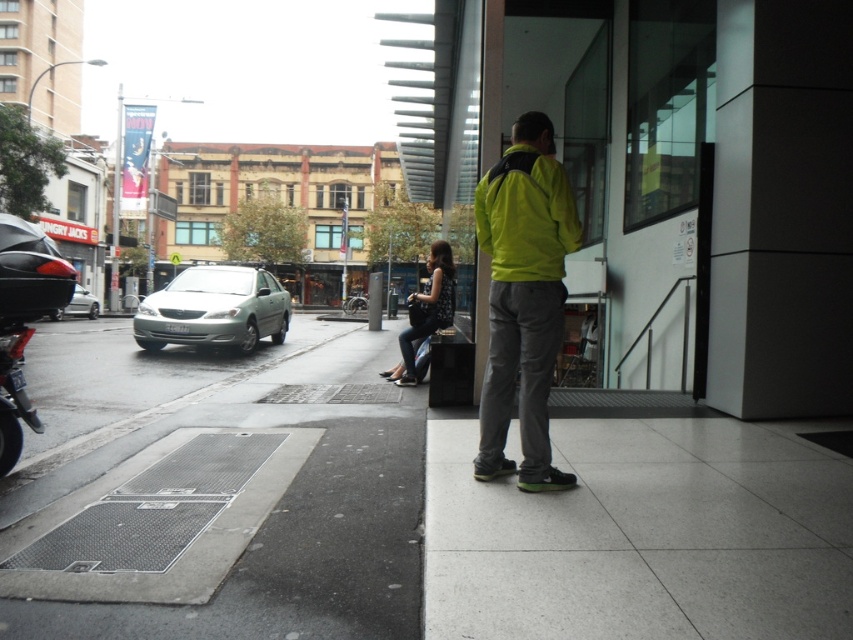
Question: Which point is farther from the camera taking this photo?

Choices:
 (A) (0, 474)
 (B) (428, 304)
 (C) (519, 198)

Answer: (B)

Question: Is white polished concrete pavement at lower center bigger than satin silver sedan at center?

Choices:
 (A) yes
 (B) no

Answer: (B)

Question: Does gray concrete pavement at lower left appear over shiny chrome motorcycle at center?

Choices:
 (A) yes
 (B) no

Answer: (B)

Question: Which of the following is the farthest from the observer?

Choices:
 (A) [x=351, y=308]
 (B) [x=169, y=467]
 (C) [x=527, y=259]

Answer: (A)

Question: Which of the following is the farthest from the observer?

Choices:
 (A) shiny chrome motorcycle at center
 (B) green matte jacket at center
 (C) white polished concrete pavement at lower center

Answer: (A)

Question: Does gray concrete pavement at lower left appear over green matte jacket at center?

Choices:
 (A) no
 (B) yes

Answer: (A)